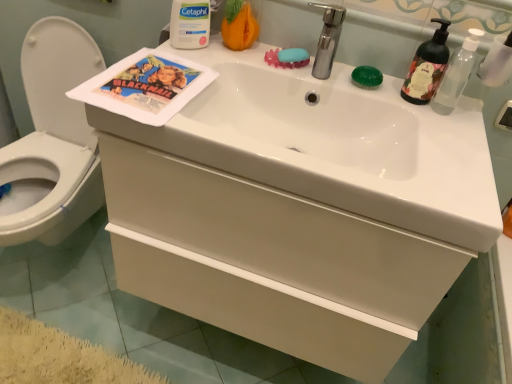
This screenshot has width=512, height=384. In order to click on free point to the right of white glossy toilet at left in this screenshot , I will do `click(125, 315)`.